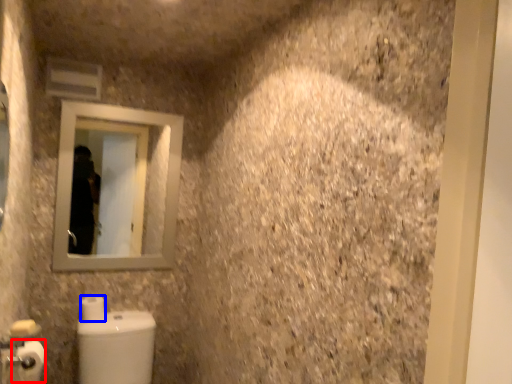
Question: Which object is further to the camera taking this photo, toilet paper (highlighted by a red box) or toilet paper (highlighted by a blue box)?

Choices:
 (A) toilet paper
 (B) toilet paper

Answer: (B)